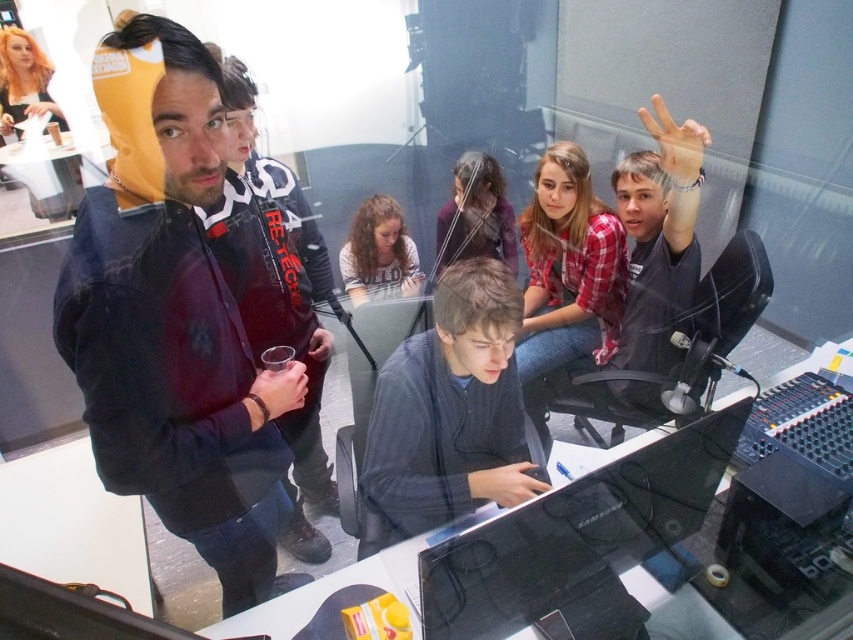
Question: Observing the image, what is the correct spatial positioning of black glossy monitor at center in reference to dark gray sweater at center?

Choices:
 (A) below
 (B) above

Answer: (A)

Question: Can you confirm if transparent glass table at center is positioned above blonde hair at upper left?

Choices:
 (A) yes
 (B) no

Answer: (B)

Question: Where is black glossy monitor at center located in relation to dark gray sweater at center in the image?

Choices:
 (A) above
 (B) below

Answer: (B)

Question: Which object appears farthest from the camera in this image?

Choices:
 (A) black glossy monitor at center
 (B) blonde hair at upper left

Answer: (B)

Question: Estimate the real-world distances between objects in this image. Which object is closer to the dark blue hoodie at left?

Choices:
 (A) black glossy monitor at center
 (B) dark brown hair at center
 (C) dark gray sweater at center
 (D) red plaid shirt at center

Answer: (C)

Question: Which point is farther to the camera?

Choices:
 (A) (457, 234)
 (B) (4, 42)

Answer: (B)